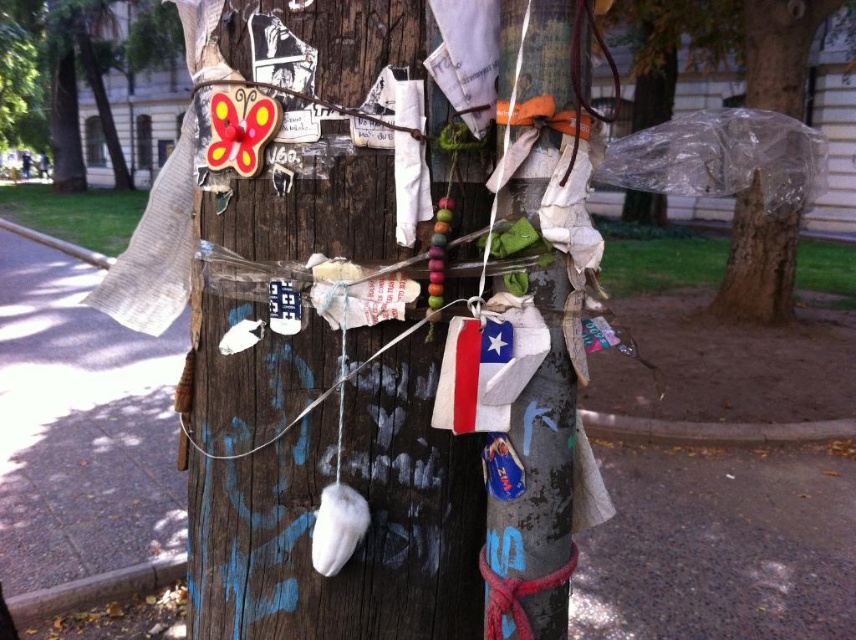
Question: Considering the relative positions of wooden pole at center and transparent plastic bag at upper right in the image provided, where is wooden pole at center located with respect to transparent plastic bag at upper right?

Choices:
 (A) above
 (B) below

Answer: (B)

Question: Which object appears closest to the camera in this image?

Choices:
 (A) wooden butterfly at upper left
 (B) wooden pole at center
 (C) transparent plastic bag at upper right

Answer: (B)

Question: Where is wooden pole at center located in relation to wooden butterfly at upper left in the image?

Choices:
 (A) above
 (B) below

Answer: (B)

Question: Which point is farther to the camera?

Choices:
 (A) wooden pole at center
 (B) wooden butterfly at upper left

Answer: (B)

Question: Which of the following is the farthest from the observer?

Choices:
 (A) transparent plastic bag at upper right
 (B) wooden butterfly at upper left

Answer: (B)

Question: Observing the image, what is the correct spatial positioning of wooden butterfly at upper left in reference to transparent plastic bag at upper right?

Choices:
 (A) below
 (B) above

Answer: (B)